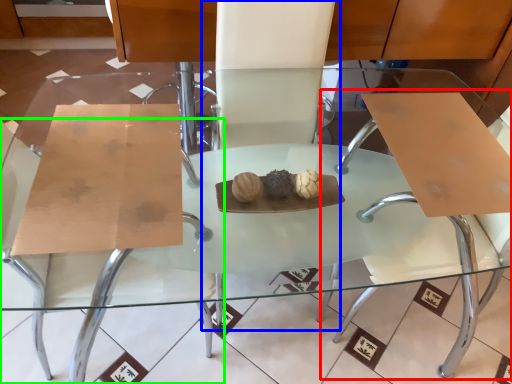
Question: Estimate the real-world distances between objects in this image. Which object is farther from swivel chair (highlighted by a red box), chair (highlighted by a blue box) or chair (highlighted by a green box)?

Choices:
 (A) chair
 (B) chair

Answer: (B)